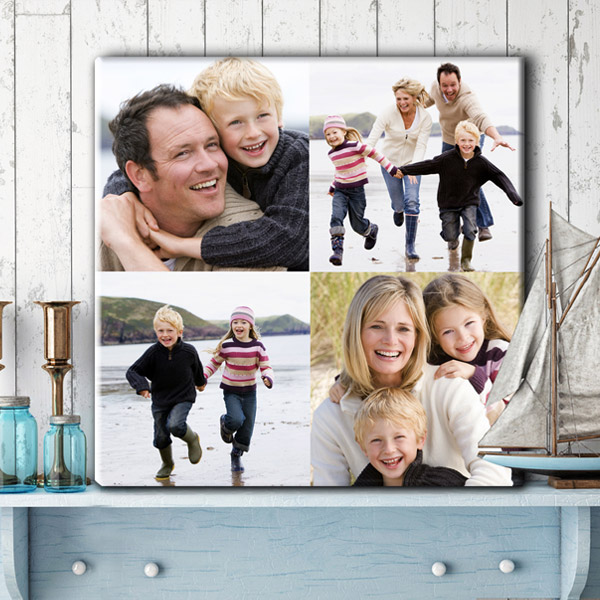
Locate an element on the screen. Image resolution: width=600 pixels, height=600 pixels. knobs is located at coordinates (78, 566), (154, 574), (432, 574), (510, 565).